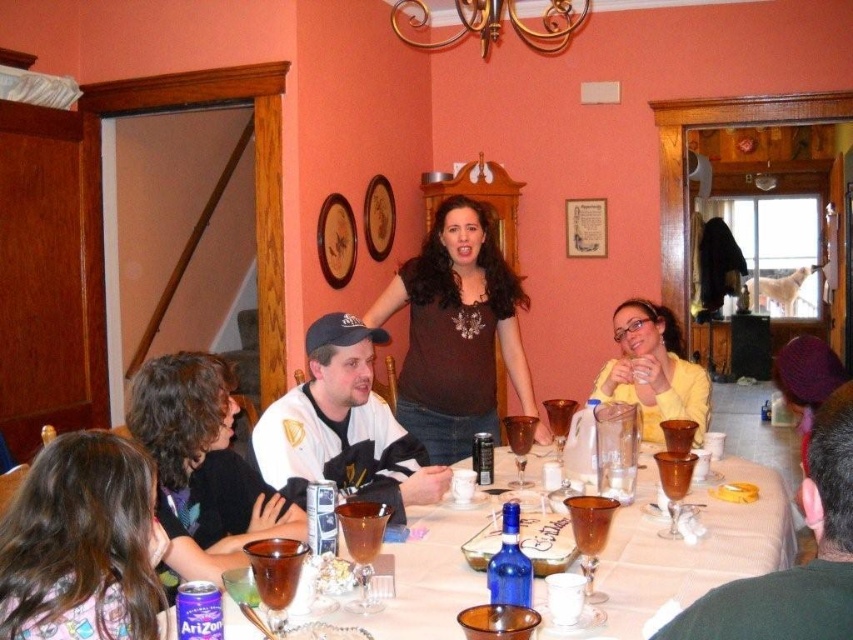
You are a guest at the dinner party and want to introduce yourself to the person with smooth brown hair at lower left. Since you are standing near the yellow matte sweater at center, can you easily walk down to greet them?

The smooth brown hair at lower left is located below the yellow matte sweater at center, so you can easily walk down to greet them since they are positioned lower than your current position.

You are a guest at the dinner party and want to know which clothing item is higher in height between the brown matte shirt at center and the yellow matte sweater at center. Can you tell me?

The brown matte shirt at center is taller than the yellow matte sweater at center.